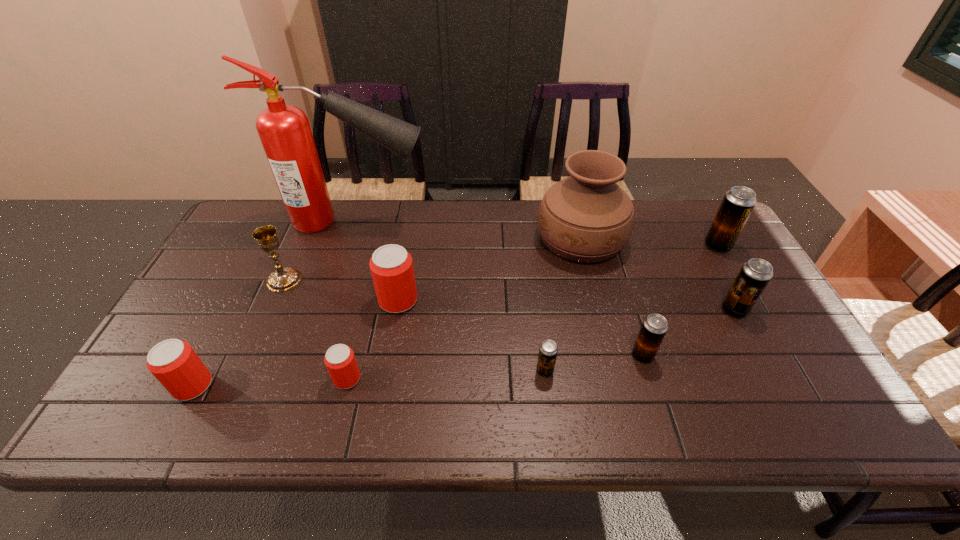
Locate an element on the screen. the fourth closest beer can to the third beer can from right to left is located at coordinates (391, 266).

Identify which beer can is located as the fourth nearest to the chalice. Please provide its 2D coordinates. Your answer should be formatted as a tuple, i.e. [(x, y)], where the tuple contains the x and y coordinates of a point satisfying the conditions above.

[(548, 350)]

At what (x,y) coordinates should I click in order to perform the action: click on the fourth closest black beer can to the chalice. Please return your answer as a coordinate pair (x, y). This screenshot has height=540, width=960. Looking at the image, I should click on (738, 203).

You are a GUI agent. You are given a task and a screenshot of the screen. Output one action in this format:
    pyautogui.click(x=<x>, y=<y>)
    Task: Click on the black beer can that is the closest to the farthest beer can
    Image resolution: width=960 pixels, height=540 pixels.
    Given the screenshot: What is the action you would take?
    pyautogui.click(x=755, y=274)

Locate which red beer can ranks in proximity to the fire extinguisher. Please provide its 2D coordinates. Your answer should be formatted as a tuple, i.e. [(x, y)], where the tuple contains the x and y coordinates of a point satisfying the conditions above.

[(391, 266)]

I want to click on red beer can that is the second closest to the farthest beer can, so click(339, 359).

I want to click on free space that satisfies the following two spatial constraints: 1. on the back side of the chalice; 2. on the right side of the farthest beer can, so click(x=300, y=246).

At what (x,y) coordinates should I click in order to perform the action: click on free spot that satisfies the following two spatial constraints: 1. at the nozzle of the farthest beer can; 2. on the left side of the tallest object. Please return your answer as a coordinate pair (x, y). Looking at the image, I should click on (345, 246).

The width and height of the screenshot is (960, 540). I want to click on free space that satisfies the following two spatial constraints: 1. at the nozzle of the fire extinguisher; 2. on the back side of the smallest red beer can, so click(x=301, y=379).